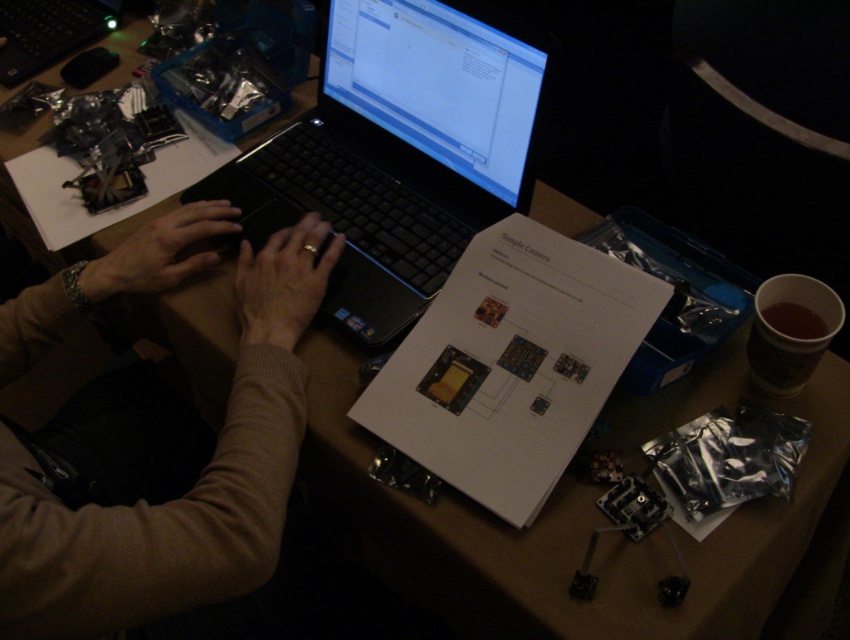
You are a virtual assistant trying to guide someone to a specific document on their laptop. The document is displayed on the screen of the black plastic laptop at upper center. The person is currently looking at the matte black hands at center. Can you tell them where to look to find the document?

The black plastic laptop at upper center is above the matte black hands at center, so the person should look upwards toward the black plastic laptop at upper center to see the document.

Looking at this image, you are a robot observing the workspace. There are two objects labeled as matte black hands at center and matte black hand at center. Which one is closer to you?

The matte black hands at center is closer to you because it is in front of the matte black hand at center.

You are a photographer who needs to take a picture of the brown sweater at center and the matte black hands at center. Which object should you focus on first if you want to capture both in the same frame without moving the camera?

The brown sweater at center is positioned on the left side of matte black hands at center, so you should focus on the brown sweater at center first to ensure both are in the frame.